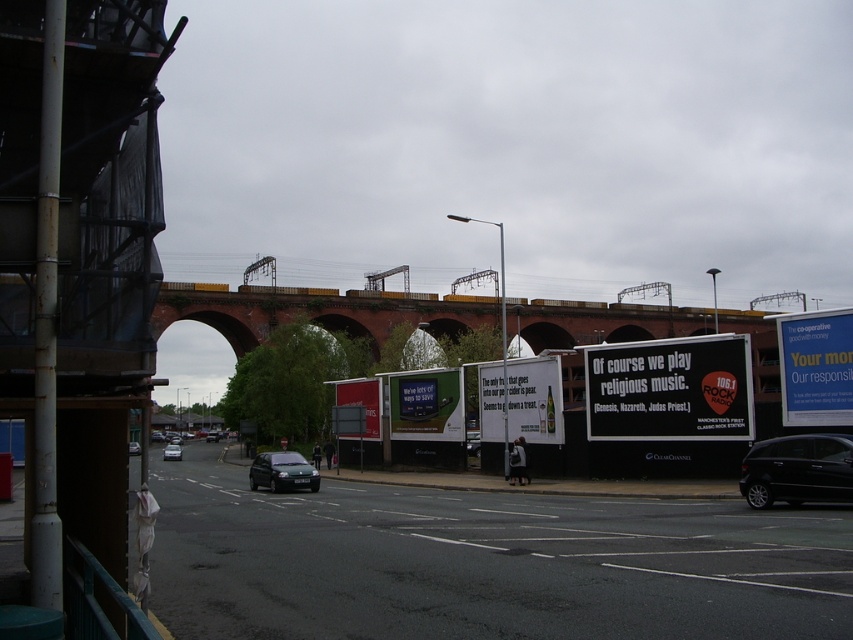
You are a pedestrian standing on the sidewalk and want to cross the road to reach the construction site on the left. There is a shiny black car at lower right and a dark green matte hatchback at center. Which vehicle should you wait for to pass first before crossing?

You should wait for the shiny black car at lower right to pass first since it is smaller and likely moves faster than the dark green matte hatchback at center.

You are standing at the point labeled as point (x=312, y=310) in the image. What structure are you currently standing on?

You are standing on the brick arch bridge at center.

You are a pedestrian standing on the sidewalk on the left side of the road. You see a shiny black car at lower right. Where is the point at coordinate (798, 468) located?

The point at coordinate (798, 468) is located on the shiny black car at lower right.